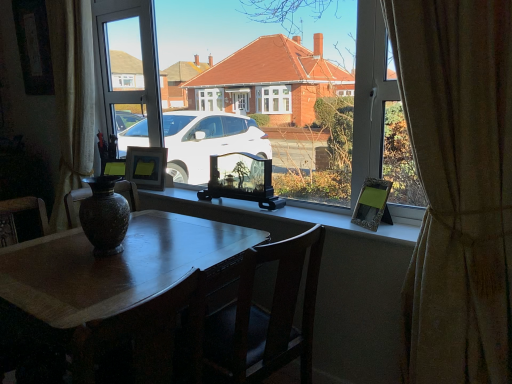
Question: Does metallic silver picture frame at right, which appears as the 3th picture frame when viewed from the back, have a lesser height compared to marbled stone vase at center?

Choices:
 (A) no
 (B) yes

Answer: (B)

Question: Does metallic silver picture frame at right, arranged as the third picture frame when viewed from the left, appear on the right side of marbled stone vase at center?

Choices:
 (A) yes
 (B) no

Answer: (A)

Question: Are metallic silver picture frame at right, acting as the 1th picture frame starting from the front, and marbled stone vase at center making contact?

Choices:
 (A) no
 (B) yes

Answer: (A)

Question: Is marbled stone vase at center located within metallic silver picture frame at right, the 1th picture frame in the right-to-left sequence?

Choices:
 (A) yes
 (B) no

Answer: (B)

Question: Is metallic silver picture frame at right, the 1th picture frame in the right-to-left sequence, positioned with its back to marbled stone vase at center?

Choices:
 (A) yes
 (B) no

Answer: (B)

Question: From a real-world perspective, relative to matte black vase at lower left, is marbled stone vase at center vertically above or below?

Choices:
 (A) below
 (B) above

Answer: (B)

Question: In terms of width, does marbled stone vase at center look wider or thinner when compared to matte black vase at lower left?

Choices:
 (A) wide
 (B) thin

Answer: (B)

Question: Would you say marbled stone vase at center is to the left or to the right of matte black vase at lower left in the picture?

Choices:
 (A) right
 (B) left

Answer: (A)

Question: From the image's perspective, relative to matte black vase at lower left, is marbled stone vase at center above or below?

Choices:
 (A) above
 (B) below

Answer: (A)

Question: Which is correct: beige textured curtain at right is inside transparent glass window at center, or outside of it?

Choices:
 (A) inside
 (B) outside

Answer: (B)

Question: From their relative heights in the image, would you say beige textured curtain at right is taller or shorter than transparent glass window at center?

Choices:
 (A) short
 (B) tall

Answer: (B)

Question: Considering the positions of point (505, 23) and point (355, 135), is point (505, 23) closer or farther from the camera than point (355, 135)?

Choices:
 (A) farther
 (B) closer

Answer: (B)

Question: In terms of size, does beige textured curtain at right appear bigger or smaller than transparent glass window at center?

Choices:
 (A) small
 (B) big

Answer: (B)

Question: From the image's perspective, is matte black vase at lower left above or below marbled stone vase at center?

Choices:
 (A) above
 (B) below

Answer: (B)

Question: Would you say matte black vase at lower left is inside or outside marbled stone vase at center?

Choices:
 (A) outside
 (B) inside

Answer: (A)